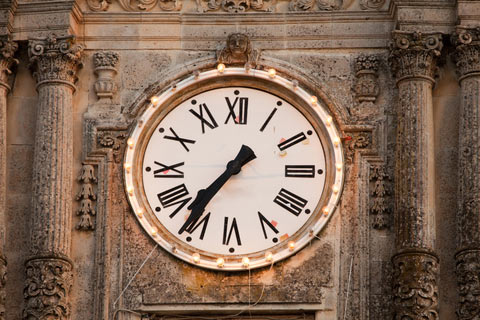
This screenshot has height=320, width=480. In order to click on face statue above clock in this screenshot , I will do `click(240, 35)`.